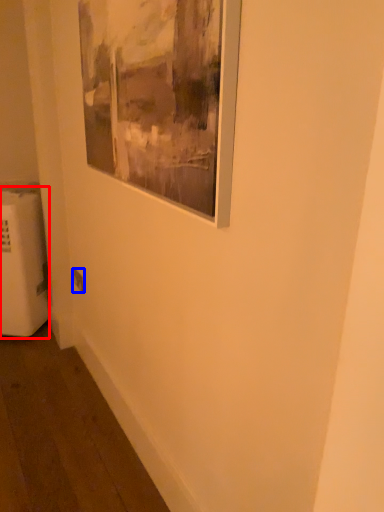
Question: Which of the following is the closest to the observer, radiator (highlighted by a red box) or electric outlet (highlighted by a blue box)?

Choices:
 (A) radiator
 (B) electric outlet

Answer: (A)